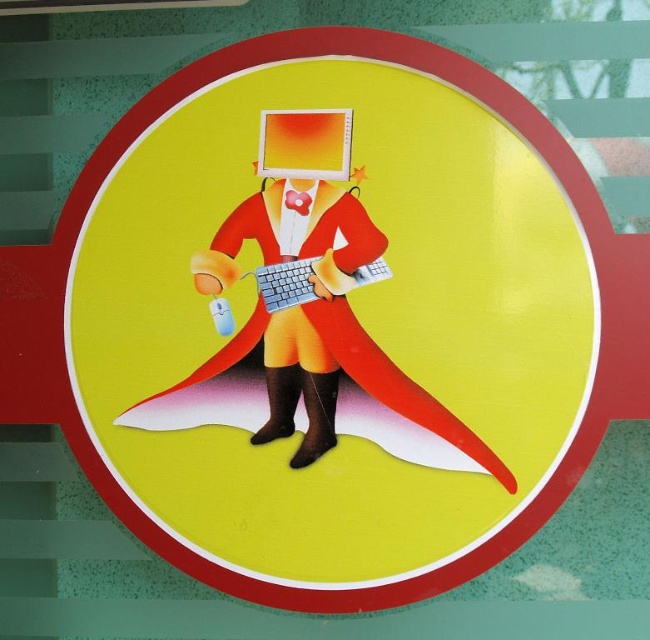
Question: In this image, where is matte orange laptop at center located relative to silver metallic keyboard at center?

Choices:
 (A) below
 (B) above

Answer: (B)

Question: Can you confirm if matte orange suit at center is thinner than matte orange laptop at center?

Choices:
 (A) no
 (B) yes

Answer: (A)

Question: Which point appears farthest from the camera in this image?

Choices:
 (A) (274, 308)
 (B) (333, 176)
 (C) (313, 221)

Answer: (A)

Question: Which is farther from the matte orange laptop at center?

Choices:
 (A) matte orange suit at center
 (B) silver metallic keyboard at center

Answer: (B)

Question: Which point appears closest to the camera in this image?

Choices:
 (A) (263, 230)
 (B) (265, 305)
 (C) (306, 116)

Answer: (C)

Question: Can you confirm if matte orange suit at center is positioned to the right of silver metallic keyboard at center?

Choices:
 (A) no
 (B) yes

Answer: (A)